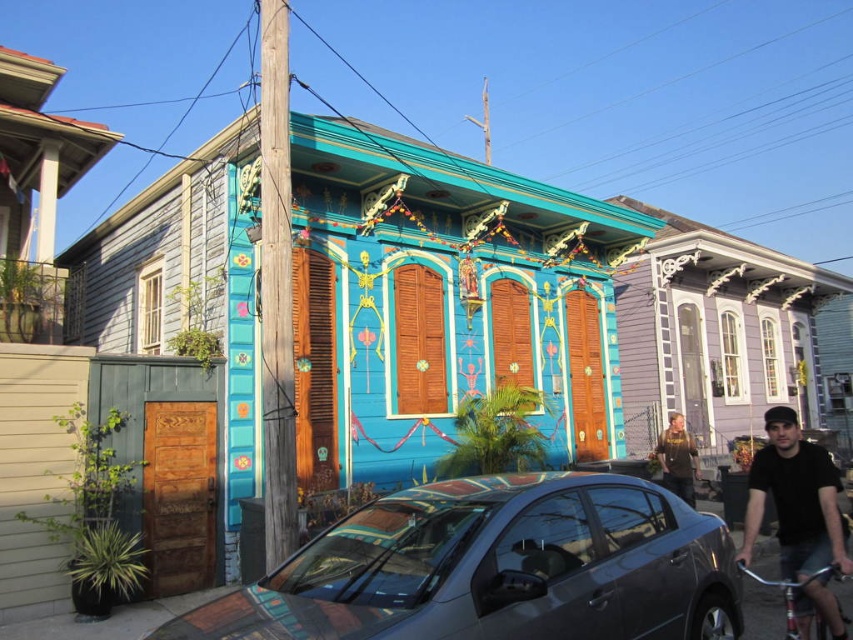
You are a delivery person who needs to park your 1.8 meters tall delivery box in the street. The delivery box must be placed between the satin black car at center and the dark brown leather jacket at center. Can the delivery box fit vertically between them?

The satin black car at center is shorter than the dark brown leather jacket at center. The vertical space between them would be determined by the height of the shorter object, which is the satin black car at center. Since the delivery box is 1.8 meters tall, we need to know the exact height of the car. However, based on the given information, we cannot confirm if the car is taller than 1.8 meters. Therefore, it is uncertain if the delivery box can fit vertically between them.

You are a delivery person who needs to park your vehicle in front of the house with the turquoise facade. The parking spot is directly in front of the house, but there is a satin black car at center and a black cotton shirt at lower right in the way. Which obstacle must you move first to access the parking spot?

You must move the satin black car at center first because it is positioned to the left of the black cotton shirt at lower right, meaning it is closer to the parking spot in front of the turquoise house.